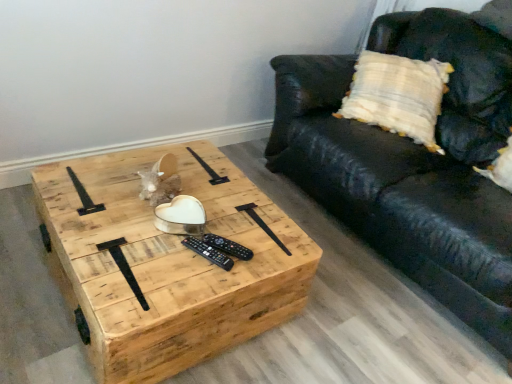
This screenshot has height=384, width=512. In order to click on free location to the right of black plastic remote at center, the 2th remote in the back-to-front sequence in this screenshot , I will do `click(258, 259)`.